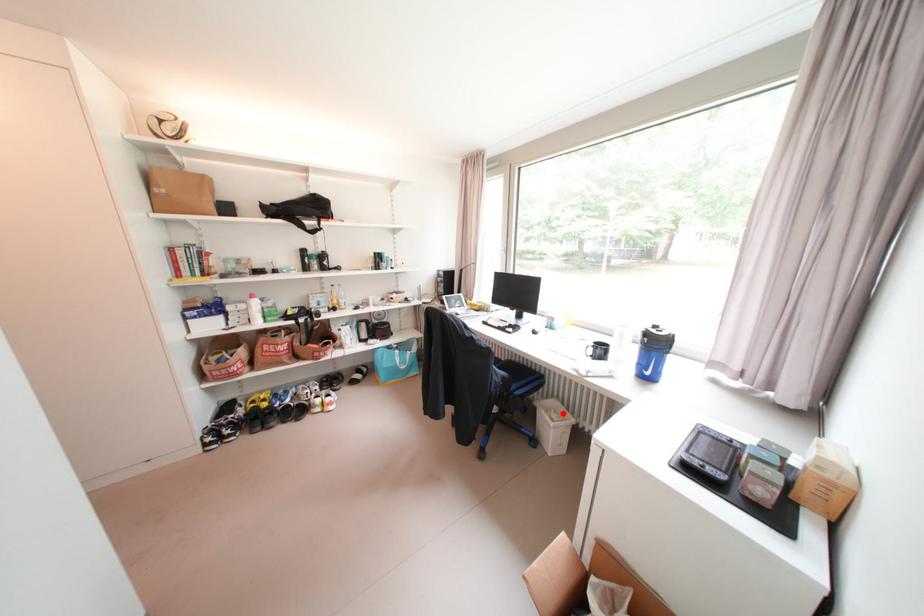
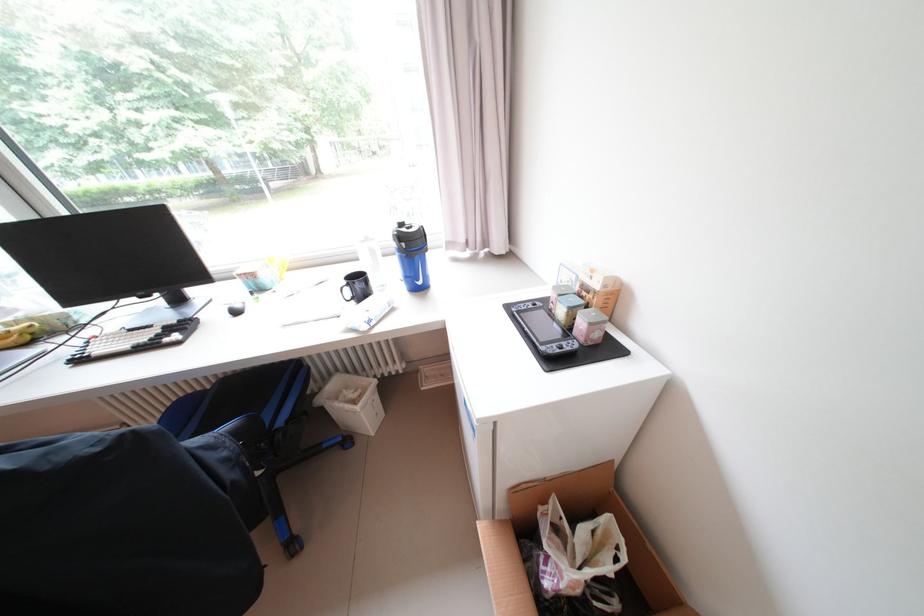
Question: I am providing you with two images of the same scene from different viewpoints. Given a red point in image1, look at the same physical point in image2. Is it:

Choices:
 (A) Closer to the viewpoint
 (B) Farther from the viewpoint

Answer: (A)